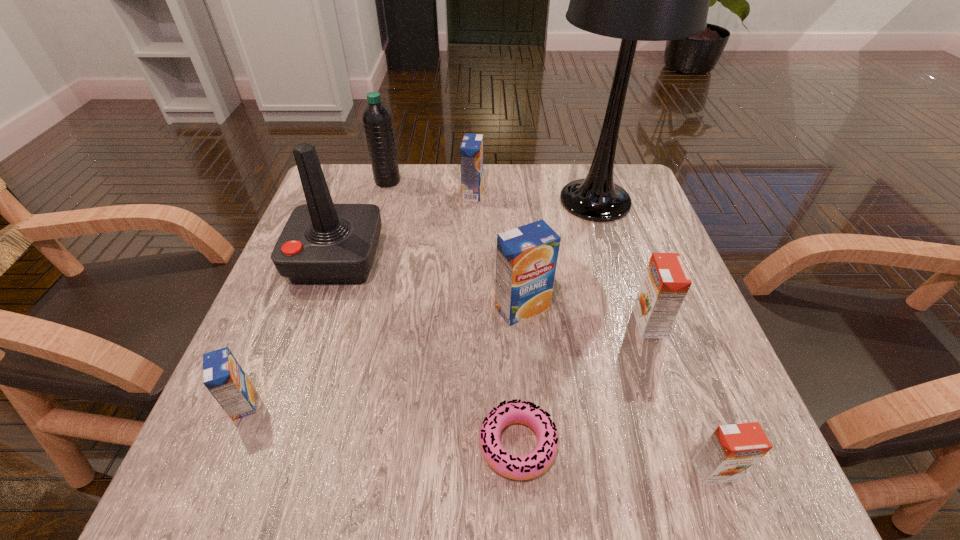
Image resolution: width=960 pixels, height=540 pixels. Identify the location of water bottle at the left edge. (377, 119).

Where is `orange_juice at the left edge`? The width and height of the screenshot is (960, 540). orange_juice at the left edge is located at coordinates (222, 375).

I want to click on table lamp that is positioned at the right edge, so click(634, 0).

You are a GUI agent. You are given a task and a screenshot of the screen. Output one action in this format:
    pyautogui.click(x=<x>, y=<y>)
    Task: Click on the object located in the far left corner section of the desktop
    This screenshot has width=960, height=540.
    Given the screenshot: What is the action you would take?
    pyautogui.click(x=377, y=119)

The height and width of the screenshot is (540, 960). In order to click on object located in the far right corner section of the desktop in this screenshot , I will do `click(634, 0)`.

You are a GUI agent. You are given a task and a screenshot of the screen. Output one action in this format:
    pyautogui.click(x=<x>, y=<y>)
    Task: Click on the object at the near right corner
    This screenshot has height=540, width=960.
    Given the screenshot: What is the action you would take?
    pyautogui.click(x=732, y=450)

I want to click on free space at the far edge of the desktop, so click(x=427, y=163).

In the image, there is a desktop. At what (x,y) coordinates should I click in order to perform the action: click on vacant space at the near edge. Please return your answer as a coordinate pair (x, y). This screenshot has height=540, width=960. Looking at the image, I should click on (571, 469).

You are a GUI agent. You are given a task and a screenshot of the screen. Output one action in this format:
    pyautogui.click(x=<x>, y=<y>)
    Task: Click on the vacant space at the right edge of the desktop
    
    Given the screenshot: What is the action you would take?
    pyautogui.click(x=629, y=233)

In the image, there is a desktop. Where is `free region at the near right corner`? free region at the near right corner is located at coordinates (650, 440).